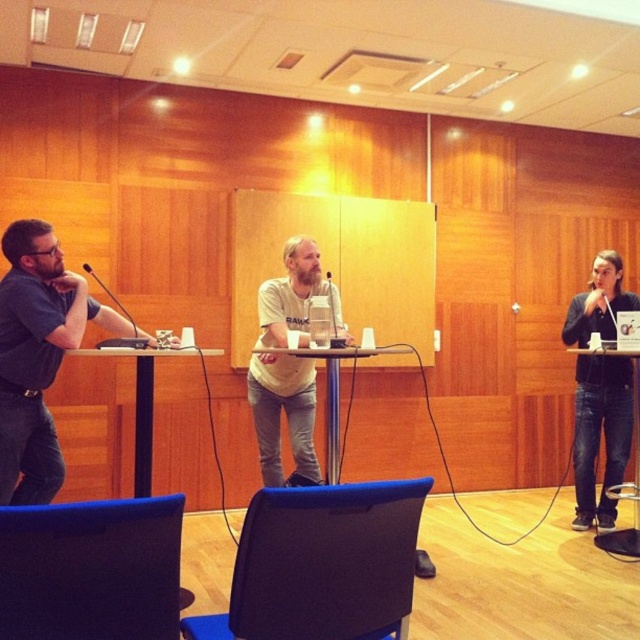
Question: Among these objects, which one is farthest from the camera?

Choices:
 (A) black matte microphone at center
 (B) white plastic table at center

Answer: (B)

Question: Estimate the real-world distances between objects in this image. Which object is farther from the brushed metal microphone at center?

Choices:
 (A) matte gray shirt at left
 (B) black matte microphone at center
 (C) matte wood table at left
 (D) white plastic table at center

Answer: (A)

Question: Based on their relative distances, which object is nearer to the black matte microphone at center?

Choices:
 (A) blue fabric chair at lower left
 (B) matte wood table at left
 (C) white plastic table at center

Answer: (B)

Question: Does black matte microphone at center have a larger size compared to brushed metal microphone at center?

Choices:
 (A) no
 (B) yes

Answer: (B)

Question: Does matte black table at center have a larger size compared to matte wood table at left?

Choices:
 (A) yes
 (B) no

Answer: (B)

Question: Does blue fabric chair at lower center appear under blue fabric chair at lower left?

Choices:
 (A) yes
 (B) no

Answer: (A)